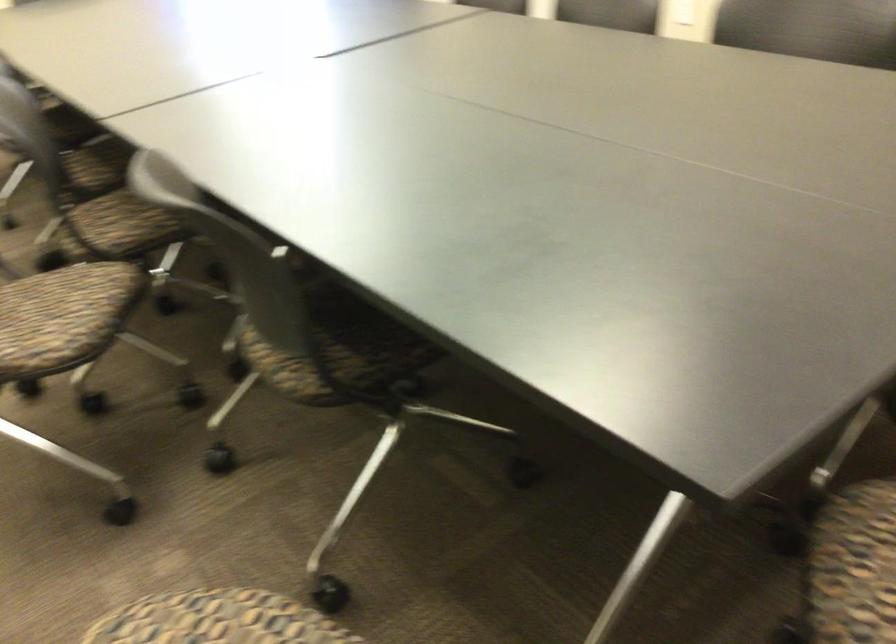
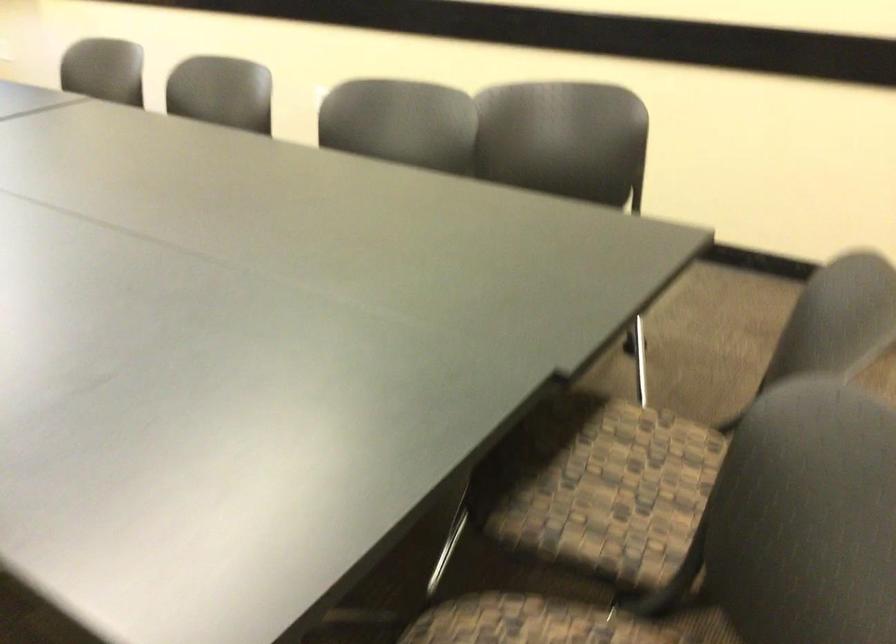
Question: The camera is either moving clockwise (left) or counter-clockwise (right) around the object. The first image is from the beginning of the video and the second image is from the end. Is the camera moving left or right when shooting the video?

Choices:
 (A) Left
 (B) Right

Answer: (A)